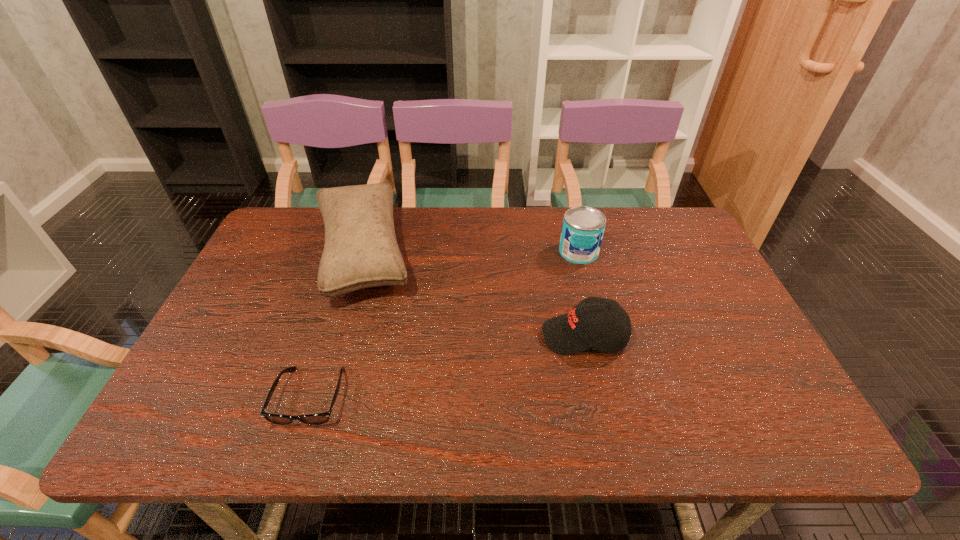
Where is `object identified as the third closest to the can`? object identified as the third closest to the can is located at coordinates (312, 419).

What are the coordinates of `vacant region that satisfies the following two spatial constraints: 1. on the front-facing side of the baseball cap; 2. on the lenses of the nearest object` in the screenshot? It's located at (597, 397).

Find the location of a particular element. Image resolution: width=960 pixels, height=540 pixels. vacant space that satisfies the following two spatial constraints: 1. on the front side of the can; 2. on the front-facing side of the second shortest object is located at coordinates (600, 336).

Find the location of a particular element. The width and height of the screenshot is (960, 540). free spot that satisfies the following two spatial constraints: 1. on the front-facing side of the third farthest object; 2. on the lenses of the spectacles is located at coordinates (597, 397).

Find the location of a particular element. Image resolution: width=960 pixels, height=540 pixels. free region that satisfies the following two spatial constraints: 1. on the front-facing side of the third farthest object; 2. on the lenses of the spectacles is located at coordinates [x=597, y=397].

Identify the location of free spot that satisfies the following two spatial constraints: 1. on the front-facing side of the third tallest object; 2. on the lenses of the nearest object. The width and height of the screenshot is (960, 540). pos(597,397).

The image size is (960, 540). What are the coordinates of `free space that satisfies the following two spatial constraints: 1. on the back side of the tallest object; 2. on the left side of the can` in the screenshot? It's located at (362, 252).

Where is `vacant region that satisfies the following two spatial constraints: 1. on the front-facing side of the third tallest object; 2. on the lenses of the nearest object`? This screenshot has height=540, width=960. vacant region that satisfies the following two spatial constraints: 1. on the front-facing side of the third tallest object; 2. on the lenses of the nearest object is located at coordinates (597, 397).